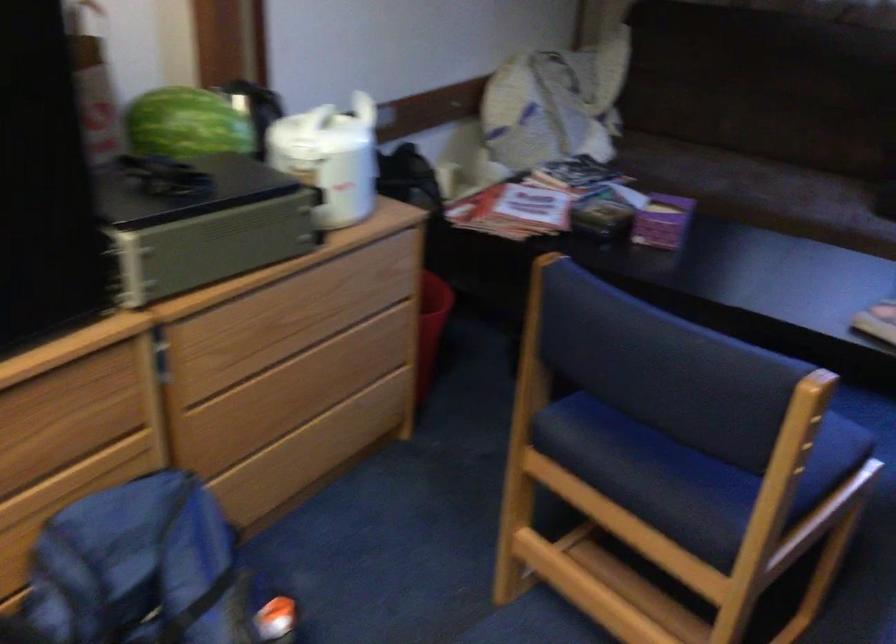
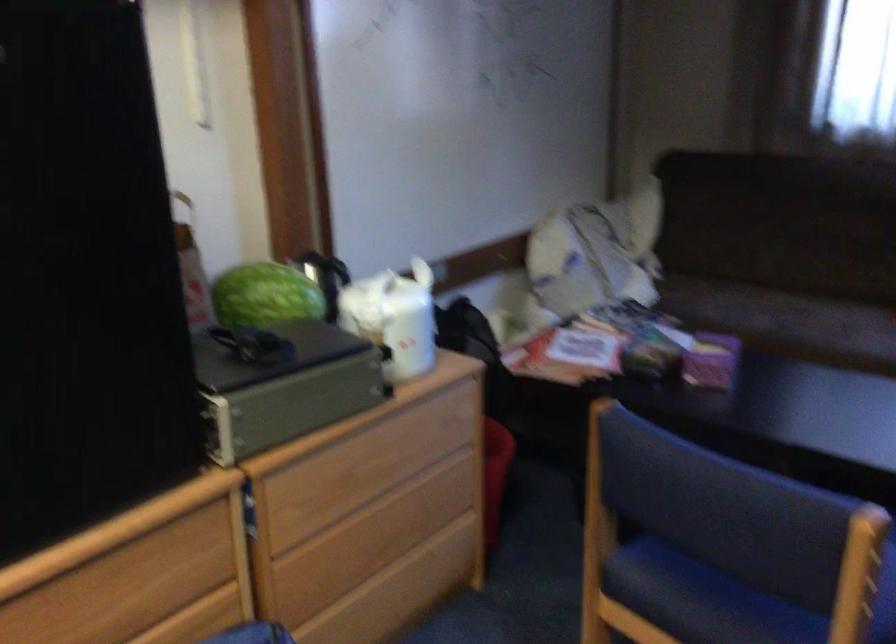
The point at (x=795, y=440) is marked in the first image. Where is the corresponding point in the second image?

(858, 574)